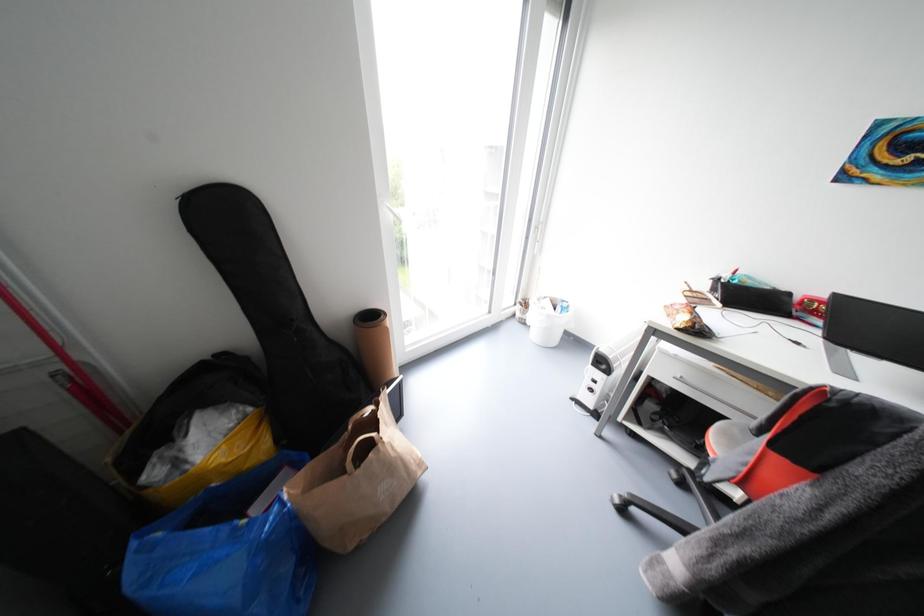
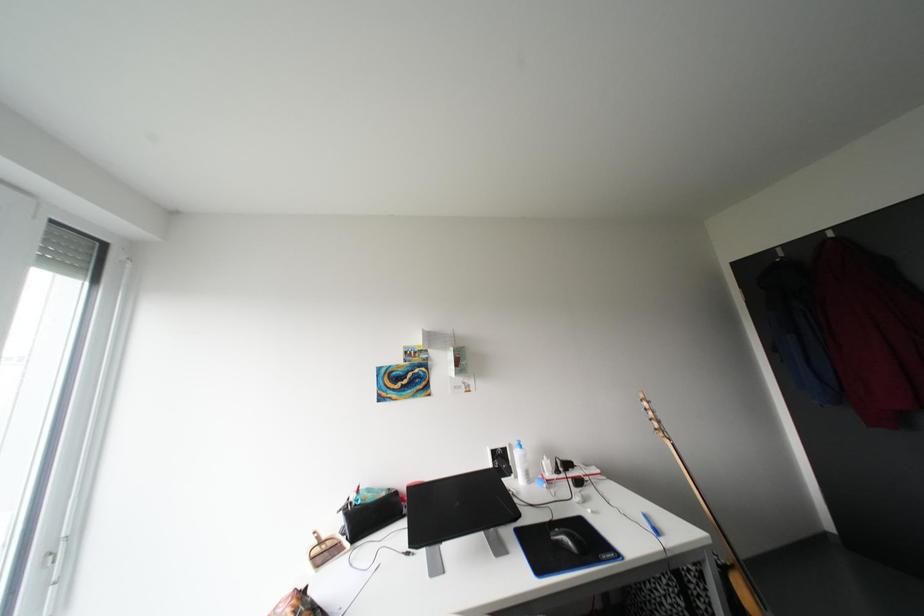
Based on the continuous images, in which direction is the camera rotating?

The rotation direction of the camera is right-up.